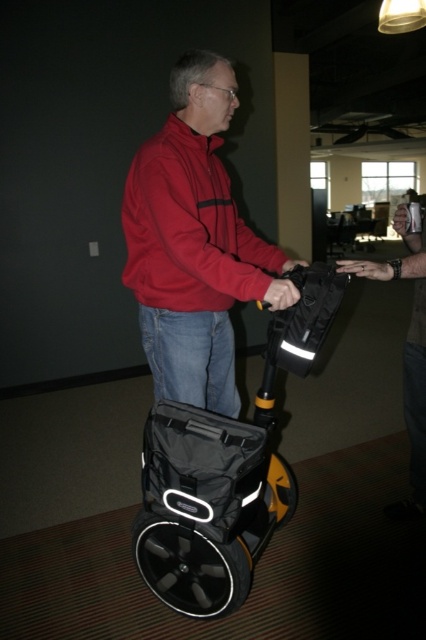
Does matte red jacket at center have a greater height compared to black matte scooter at center?

Correct, matte red jacket at center is much taller as black matte scooter at center.

Between point (233, 397) and point (187, 444), which one is positioned in front?

Point (187, 444)

Where is `matte red jacket at center`? The width and height of the screenshot is (426, 640). matte red jacket at center is located at coordinates (193, 243).

Between matte red jacket at center and denim jacket at center, which one is positioned higher?

Positioned higher is matte red jacket at center.

Who is positioned more to the right, matte red jacket at center or denim jacket at center?

denim jacket at center is more to the right.

This screenshot has width=426, height=640. Identify the location of matte red jacket at center. (193, 243).

Where is `matte red jacket at center`? matte red jacket at center is located at coordinates (193, 243).

Is black matte scooter at center closer to the viewer compared to denim jacket at center?

Yes, black matte scooter at center is in front of denim jacket at center.

Does black matte scooter at center have a lesser width compared to denim jacket at center?

No, black matte scooter at center is not thinner than denim jacket at center.

Where is `black matte scooter at center`? The image size is (426, 640). black matte scooter at center is located at coordinates (226, 472).